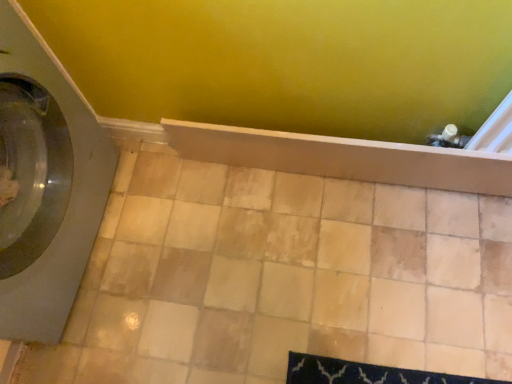
What is the approximate height of satin gray washing machine at left?

satin gray washing machine at left is 27.31 inches in height.

What do you see at coordinates (281, 278) in the screenshot? This screenshot has height=384, width=512. I see `beige ceramic tile at center` at bounding box center [281, 278].

This screenshot has height=384, width=512. I want to click on satin gray washing machine at left, so 45,186.

Looking at this image, considering the sizes of objects wooden shelf at center and beige ceramic tile at center in the image provided, who is smaller, wooden shelf at center or beige ceramic tile at center?

Smaller between the two is wooden shelf at center.

From the picture: Is wooden shelf at center at the right side of beige ceramic tile at center?

Yes, wooden shelf at center is to the right of beige ceramic tile at center.

Is point (464, 167) farther from camera compared to point (312, 179)?

No, it is in front of (312, 179).

Is wooden shelf at center directly adjacent to beige ceramic tile at center?

No, wooden shelf at center is not touching beige ceramic tile at center.

From a real-world perspective, relative to beige ceramic tile at center, is satin gray washing machine at left vertically above or below?

satin gray washing machine at left is above beige ceramic tile at center.

Based on their positions, is satin gray washing machine at left located to the left or right of beige ceramic tile at center?

satin gray washing machine at left is to the left of beige ceramic tile at center.

Which of these two, satin gray washing machine at left or beige ceramic tile at center, stands taller?

With more height is satin gray washing machine at left.

Is satin gray washing machine at left positioned with its back to beige ceramic tile at center?

satin gray washing machine at left does not have its back to beige ceramic tile at center.

From a real-world perspective, which object stands above the other?

satin gray washing machine at left is physically above.

Which is more to the right, beige ceramic tile at center or satin gray washing machine at left?

From the viewer's perspective, beige ceramic tile at center appears more on the right side.

Which is in front, beige ceramic tile at center or satin gray washing machine at left?

satin gray washing machine at left is more forward.

Can you confirm if beige ceramic tile at center is shorter than satin gray washing machine at left?

Correct, beige ceramic tile at center is not as tall as satin gray washing machine at left.

Identify the location of washing machine in front of the wooden shelf at center. (45, 186).

Is wooden shelf at center spatially inside satin gray washing machine at left, or outside of it?

wooden shelf at center is located beyond the bounds of satin gray washing machine at left.

Is wooden shelf at center oriented towards satin gray washing machine at left?

No, wooden shelf at center is not oriented towards satin gray washing machine at left.

Which point is more forward, (140,168) or (282,147)?

The point (282,147) is closer.

Would you say beige ceramic tile at center is inside or outside wooden shelf at center?

beige ceramic tile at center lies outside wooden shelf at center.

From the picture: Which is more to the left, beige ceramic tile at center or wooden shelf at center?

beige ceramic tile at center is more to the left.

Looking at their sizes, would you say beige ceramic tile at center is wider or thinner than wooden shelf at center?

beige ceramic tile at center is wider than wooden shelf at center.

Is satin gray washing machine at left looking in the opposite direction of wooden shelf at center?

That's not correct — satin gray washing machine at left is not looking away from wooden shelf at center.

Is satin gray washing machine at left taller or shorter than wooden shelf at center?

satin gray washing machine at left is taller than wooden shelf at center.

Does satin gray washing machine at left appear on the right side of wooden shelf at center?

Incorrect, satin gray washing machine at left is not on the right side of wooden shelf at center.

In the image, is satin gray washing machine at left positioned in front of or behind wooden shelf at center?

satin gray washing machine at left is positioned closer to the viewer than wooden shelf at center.

The width and height of the screenshot is (512, 384). In order to click on ceramic tile behind the wooden shelf at center in this screenshot , I will do `click(281, 278)`.

I want to click on washing machine above the beige ceramic tile at center (from the image's perspective), so click(45, 186).

Estimate the real-world distances between objects in this image. Which object is further from beige ceramic tile at center, wooden shelf at center or satin gray washing machine at left?

Based on the image, satin gray washing machine at left appears to be further to beige ceramic tile at center.

When comparing their distances from beige ceramic tile at center, does satin gray washing machine at left or wooden shelf at center seem closer?

Based on the image, wooden shelf at center appears to be nearer to beige ceramic tile at center.

Considering their positions, is beige ceramic tile at center positioned further to satin gray washing machine at left than wooden shelf at center?

Based on the image, wooden shelf at center appears to be further to satin gray washing machine at left.

Based on their spatial positions, is wooden shelf at center or beige ceramic tile at center closer to satin gray washing machine at left?

Among the two, beige ceramic tile at center is located nearer to satin gray washing machine at left.

When comparing their distances from wooden shelf at center, does satin gray washing machine at left or beige ceramic tile at center seem further?

satin gray washing machine at left.

Which object lies nearer to the anchor point wooden shelf at center, beige ceramic tile at center or satin gray washing machine at left?

beige ceramic tile at center.

At what (x,y) coordinates should I click in order to perform the action: click on ceramic tile situated between satin gray washing machine at left and wooden shelf at center from left to right. Please return your answer as a coordinate pair (x, y). The width and height of the screenshot is (512, 384). Looking at the image, I should click on point(281,278).